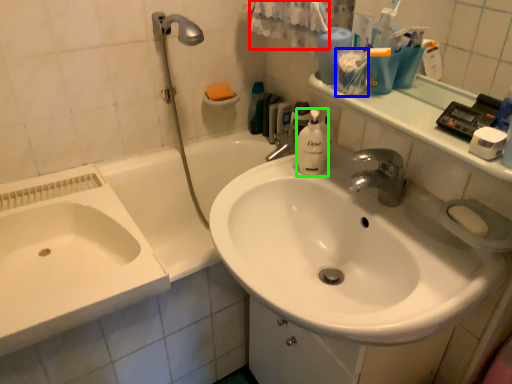
Question: Considering the real-world distances, which object is closest to bath towel (highlighted by a red box)? mouthwash (highlighted by a blue box) or cleaning product (highlighted by a green box).

Choices:
 (A) mouthwash
 (B) cleaning product

Answer: (B)